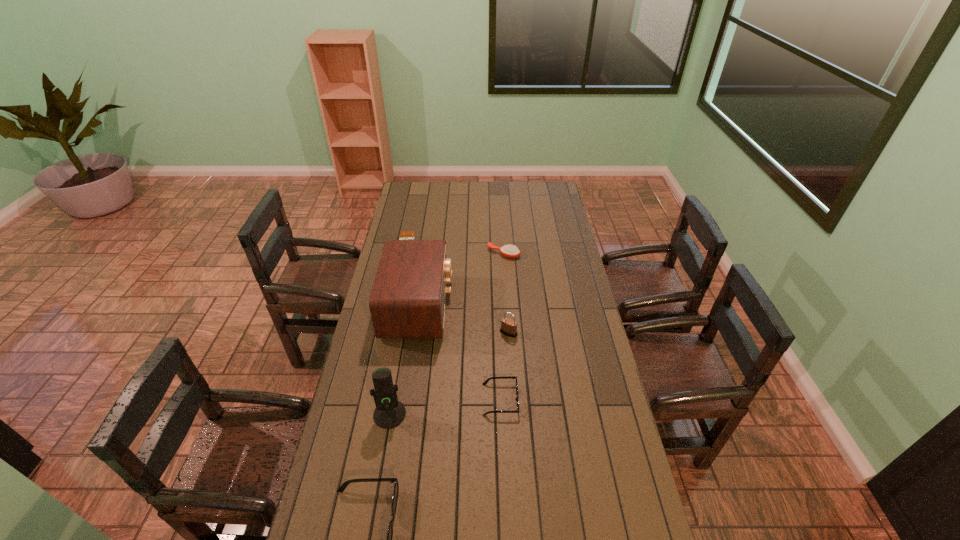
What are the coordinates of `vacant area at the near right corner of the desktop` in the screenshot? It's located at (650, 538).

This screenshot has height=540, width=960. Identify the location of free area in between the shortest object and the right sunglasses. (454, 321).

This screenshot has width=960, height=540. I want to click on vacant space that's between the microphone and the third tallest object, so click(449, 374).

In order to click on free space between the radio receiver and the microphone in this screenshot , I will do `click(404, 361)`.

Choose which object is the nearest neighbor to the radio receiver. Please provide its 2D coordinates. Your answer should be formatted as a tuple, i.e. [(x, y)], where the tuple contains the x and y coordinates of a point satisfying the conditions above.

[(410, 235)]

Find the location of a particular element. This screenshot has width=960, height=540. object that stands as the fifth closest to the hairbrush is located at coordinates (389, 413).

In order to click on free space in the image that satisfies the following two spatial constraints: 1. on the back side of the microphone; 2. on the left side of the hairbrush in this screenshot , I will do `click(418, 253)`.

Find the location of `free location that satisfies the following two spatial constraints: 1. on the front panel of the radio receiver; 2. on the left side of the padlock`. free location that satisfies the following two spatial constraints: 1. on the front panel of the radio receiver; 2. on the left side of the padlock is located at coordinates (415, 333).